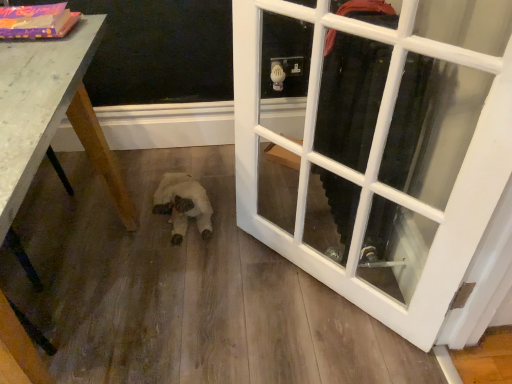
This screenshot has width=512, height=384. What are the coordinates of `free point in front of white plush toy at center` in the screenshot? It's located at (174, 263).